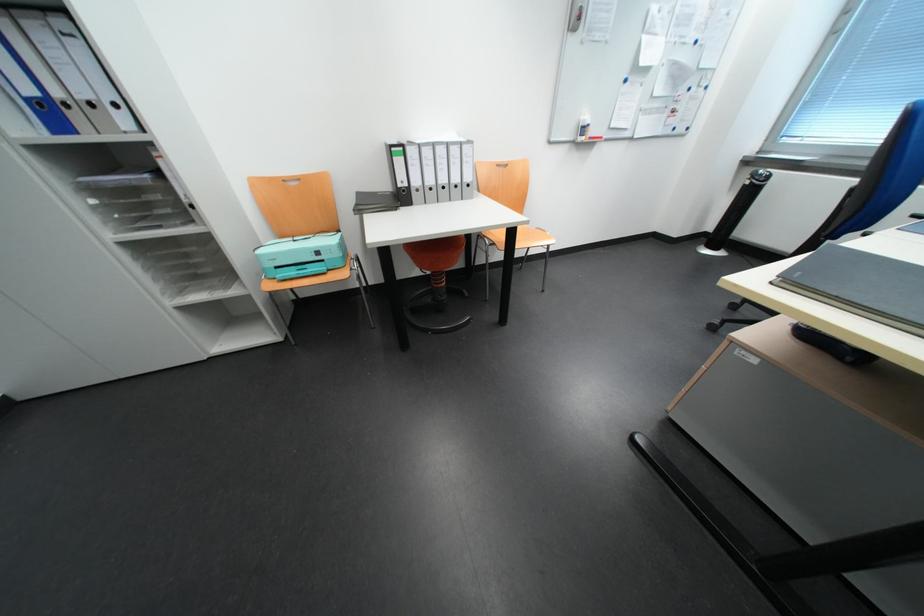
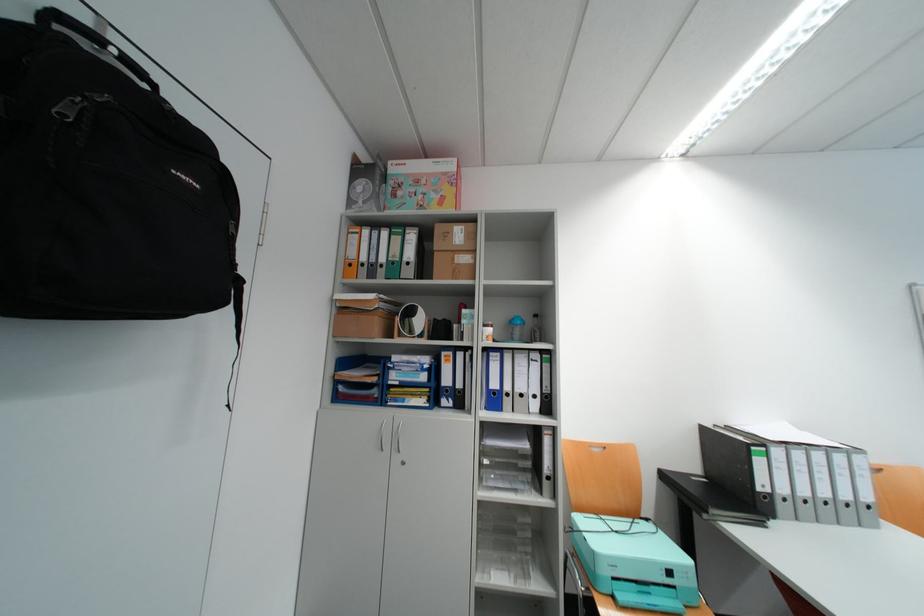
Find the pixel in the second image that matches the point at 284,257 in the first image.

(624, 562)